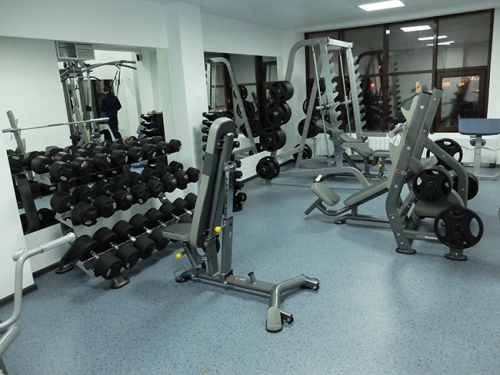
Identify the location of mirrors. The image size is (500, 375). (33, 116), (243, 68), (128, 81), (245, 141).